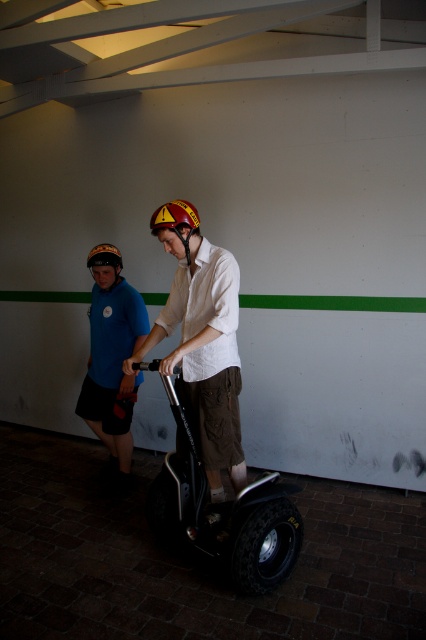
Question: Which point appears farthest from the camera in this image?

Choices:
 (A) (118, 323)
 (B) (235, 445)
 (C) (169, 204)
 (D) (273, 554)

Answer: (A)

Question: Is black rubber scooter at center wider than yellow/red reflective helmet at center?

Choices:
 (A) yes
 (B) no

Answer: (A)

Question: Which object is farther from the camera taking this photo?

Choices:
 (A) matte blue shirt at left
 (B) black rubber scooter at center
 (C) yellow/red reflective helmet at center

Answer: (A)

Question: Does matte white shirt at center appear over matte blue shirt at left?

Choices:
 (A) no
 (B) yes

Answer: (B)

Question: In this image, where is black rubber scooter at center located relative to yellow/red reflective helmet at center?

Choices:
 (A) below
 (B) above

Answer: (A)

Question: Based on their relative distances, which object is nearer to the matte black helmet at upper center?

Choices:
 (A) yellow/red reflective helmet at center
 (B) matte blue shirt at left

Answer: (B)